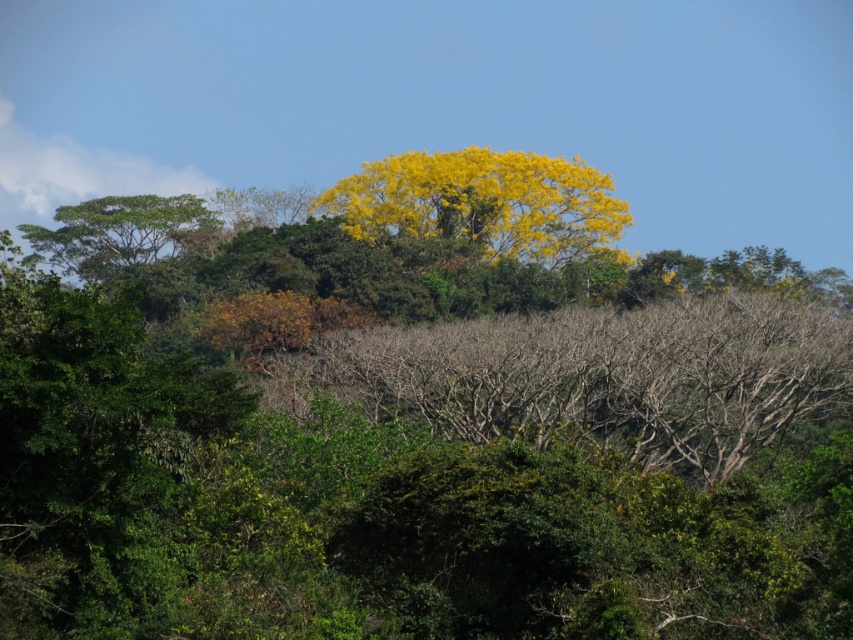
Does point (473, 216) come in front of point (65, 268)?

Yes, point (473, 216) is closer to viewer.

Which is in front, point (505, 198) or point (160, 236)?

Point (505, 198) is more forward.

This screenshot has height=640, width=853. I want to click on yellow leafy tree at center, so click(x=482, y=202).

The height and width of the screenshot is (640, 853). What are the coordinates of `yellow leafy tree at center` in the screenshot? It's located at (482, 202).